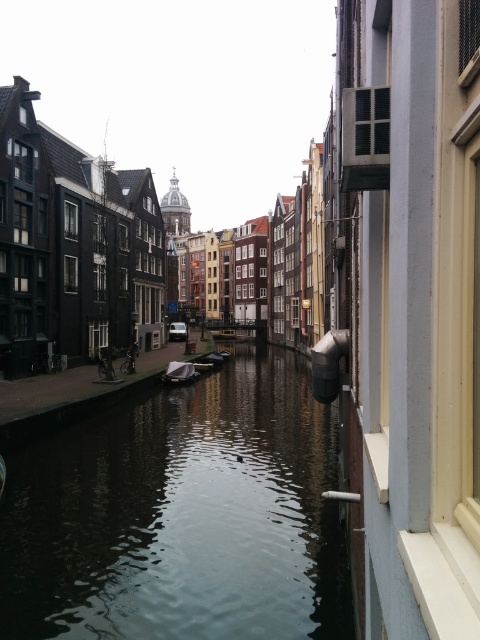
Can you confirm if metallic gray boat at center is smaller than wooden boat at center?

No.

Between point (181, 372) and point (200, 368), which one is positioned behind?

The point (200, 368) is behind.

What do you see at coordinates (180, 372) in the screenshot? I see `metallic gray boat at center` at bounding box center [180, 372].

Locate an element on the screen. The image size is (480, 640). metallic gray boat at center is located at coordinates (180, 372).

Who is positioned more to the left, dark reflective water at center or metallic gray boat at center?

From the viewer's perspective, metallic gray boat at center appears more on the left side.

Is dark reflective water at center above metallic gray boat at center?

No, dark reflective water at center is not above metallic gray boat at center.

The height and width of the screenshot is (640, 480). Describe the element at coordinates (181, 516) in the screenshot. I see `dark reflective water at center` at that location.

The width and height of the screenshot is (480, 640). What are the coordinates of `dark reflective water at center` in the screenshot? It's located at (181, 516).

Is dark reflective water at center behind wooden boat at center?

No, it is in front of wooden boat at center.

Is dark reflective water at center taller than wooden boat at center?

Yes, dark reflective water at center is taller than wooden boat at center.

Between point (96, 596) and point (201, 362), which one is positioned behind?

The point (201, 362) is more distant.

Locate an element on the screen. The image size is (480, 640). dark reflective water at center is located at coordinates (181, 516).